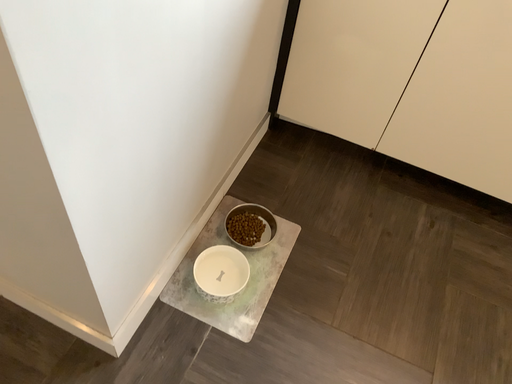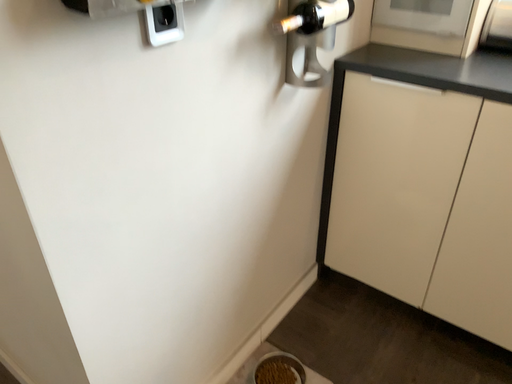
Question: Which way did the camera rotate in the video?

Choices:
 (A) rotated downward
 (B) rotated upward

Answer: (B)